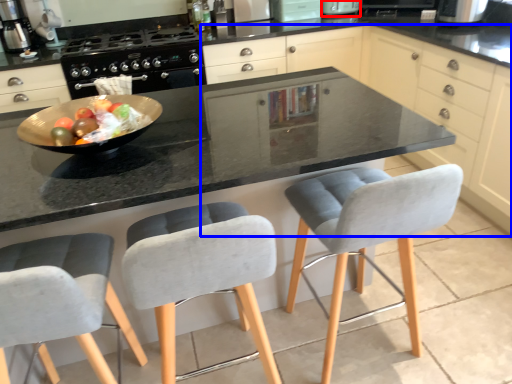
Question: Which object appears farthest to the camera in this image, appliance (highlighted by a red box) or cabinetry (highlighted by a blue box)?

Choices:
 (A) appliance
 (B) cabinetry

Answer: (A)